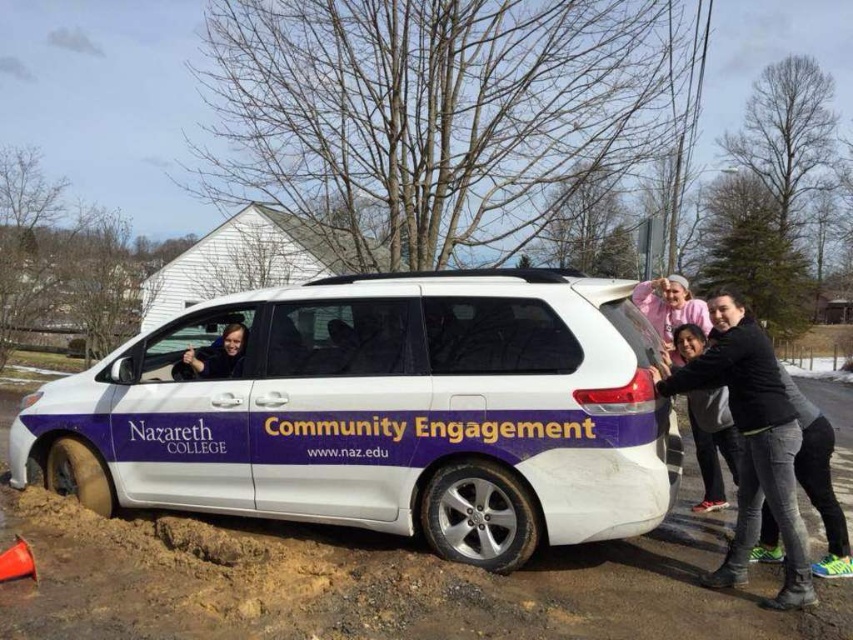
Measure the distance between point (x=457, y=307) and camera.

Point (x=457, y=307) and camera are 4.90 meters apart.

The width and height of the screenshot is (853, 640). Describe the element at coordinates (381, 413) in the screenshot. I see `white matte van at center` at that location.

Is point (550, 305) in front of point (173, 364)?

Yes.

Image resolution: width=853 pixels, height=640 pixels. I want to click on white matte van at center, so click(x=381, y=413).

Between white matte van at center and black matte shirt at center, which one appears on the right side from the viewer's perspective?

From the viewer's perspective, black matte shirt at center appears more on the right side.

Between point (267, 376) and point (751, 353), which one is positioned behind?

The point (267, 376) is more distant.

Locate an element on the screen. The height and width of the screenshot is (640, 853). white matte van at center is located at coordinates (381, 413).

Between black matte shirt at center and matte black face at center, which one has less height?

matte black face at center

What do you see at coordinates (753, 445) in the screenshot? The image size is (853, 640). I see `black matte shirt at center` at bounding box center [753, 445].

Which is behind, point (809, 579) or point (236, 332)?

The point (236, 332) is behind.

The width and height of the screenshot is (853, 640). I want to click on black matte shirt at center, so click(x=753, y=445).